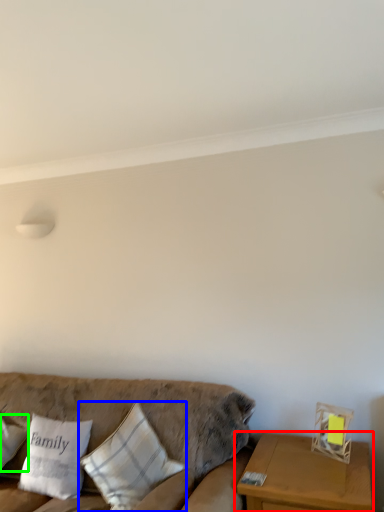
Question: Which object is positioned farthest from table (highlighted by a red box)? Select from pillow (highlighted by a blue box) and pillow (highlighted by a green box).

Choices:
 (A) pillow
 (B) pillow

Answer: (B)